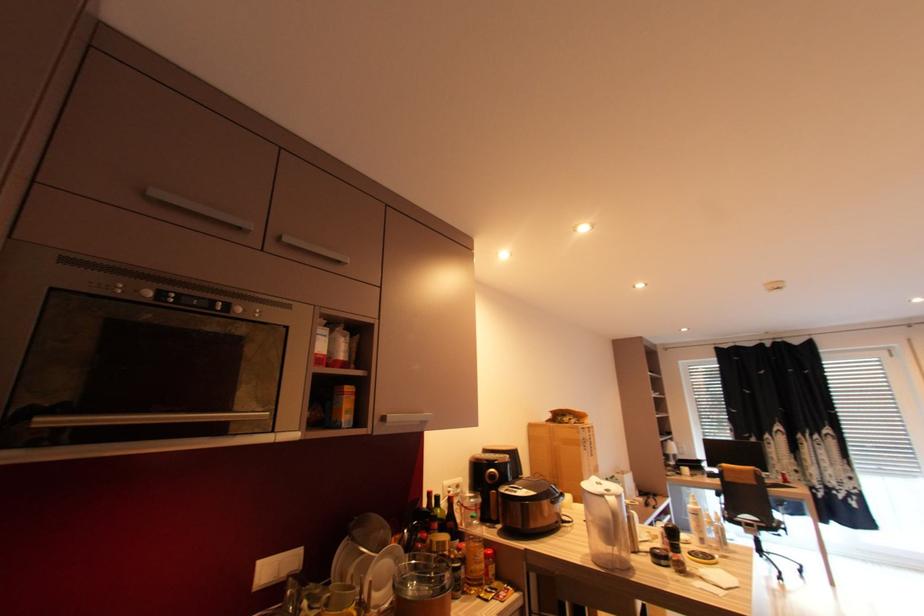
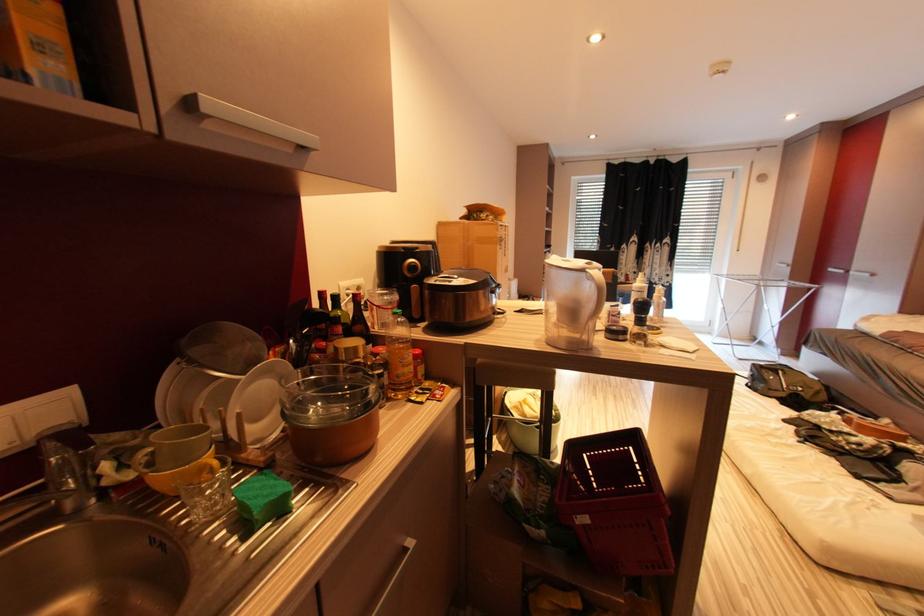
The first image is from the beginning of the video and the second image is from the end. How did the camera likely rotate when shooting the video?

The rotation direction of the camera is right-down.